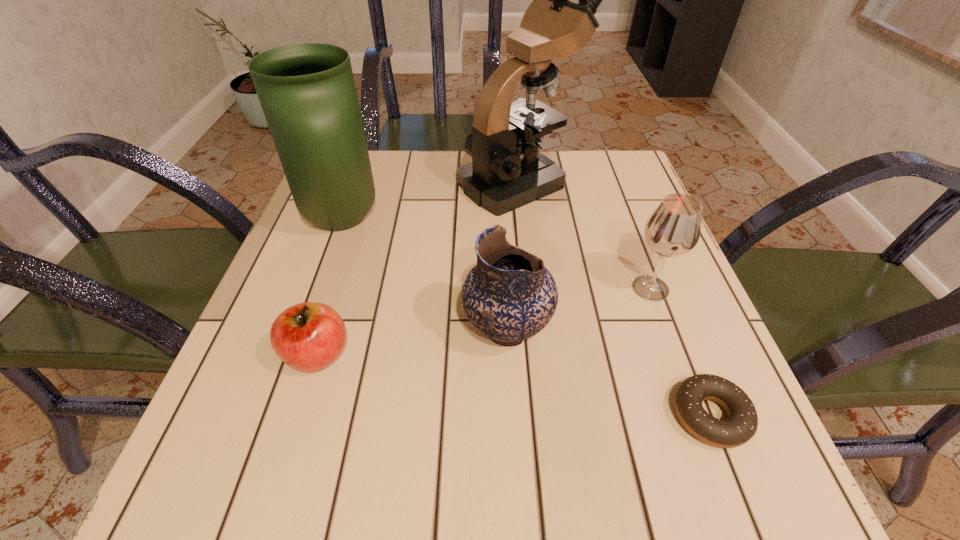
The height and width of the screenshot is (540, 960). I want to click on microscope, so click(507, 171).

Locate an element on the screen. the second tallest object is located at coordinates (307, 92).

You are a GUI agent. You are given a task and a screenshot of the screen. Output one action in this format:
    pyautogui.click(x=<x>, y=<y>)
    Task: Click on the wineglass
    This screenshot has width=960, height=540.
    Given the screenshot: What is the action you would take?
    pyautogui.click(x=673, y=229)

I want to click on pottery, so click(x=509, y=296).

This screenshot has width=960, height=540. In order to click on the second shortest object in this screenshot , I will do `click(309, 336)`.

You are a GUI agent. You are given a task and a screenshot of the screen. Output one action in this format:
    pyautogui.click(x=<x>, y=<y>)
    Task: Click on the shortest object
    
    Given the screenshot: What is the action you would take?
    pyautogui.click(x=741, y=425)

Where is `the nearest object`? Image resolution: width=960 pixels, height=540 pixels. the nearest object is located at coordinates (741, 425).

You are a GUI agent. You are given a task and a screenshot of the screen. Output one action in this format:
    pyautogui.click(x=<x>, y=<y>)
    Task: Click on the vacant space located on the left of the microscope
    This screenshot has width=960, height=540.
    Given the screenshot: What is the action you would take?
    pyautogui.click(x=362, y=183)

Find the location of a particular element. vacant space located on the front of the fifth shortest object is located at coordinates (301, 336).

The image size is (960, 540). Identify the location of free spot located on the front of the wineglass. (686, 384).